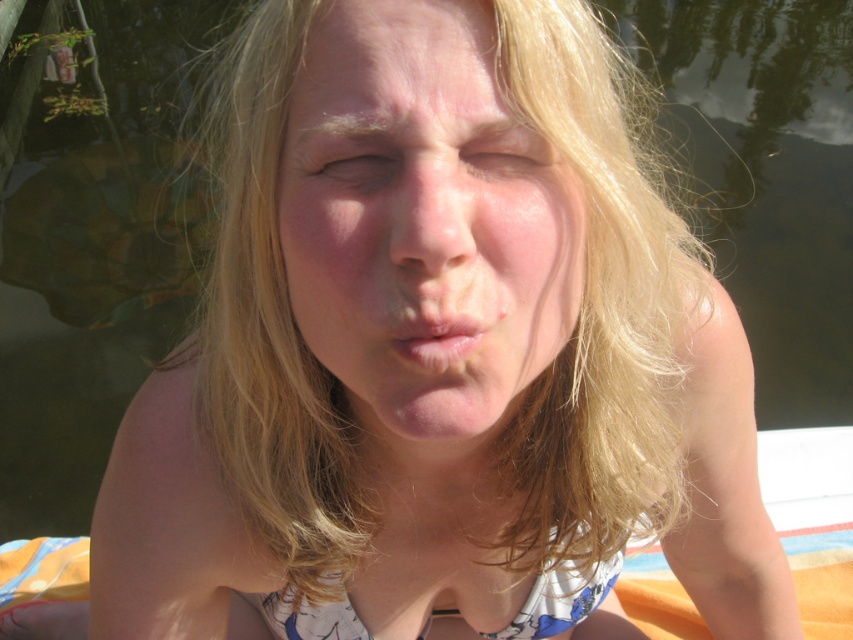
You are a photographer trying to capture a clear shot of the person in the image. Since you want to focus on their facial features, which object should you prioritize focusing on first, the blonde hair at center or the pale pink lips at center?

The blonde hair at center is further to the viewer than the pale pink lips at center, so you should prioritize focusing on the pale pink lips at center first because they are closer to the camera and require sharp focus for facial features.

Based on the scene description, can you determine which object is wider between the smooth skin face at center and the smooth skin nose at center?

The smooth skin face at center is wider than the smooth skin nose at center according to the description.

Based on the scene description, if you were to compare the sizes of the smooth skin face at center and the smooth skin nose at center, which one would appear bigger?

The smooth skin face at center appears larger than the smooth skin nose at center.